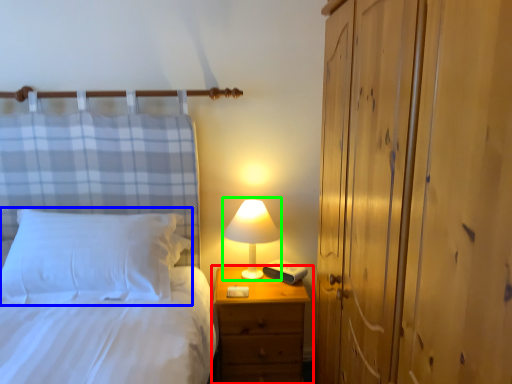
Question: Based on their relative distances, which object is farther from nightstand (highlighted by a red box)? Choose from pillow (highlighted by a blue box) and table lamp (highlighted by a green box).

Choices:
 (A) pillow
 (B) table lamp

Answer: (A)